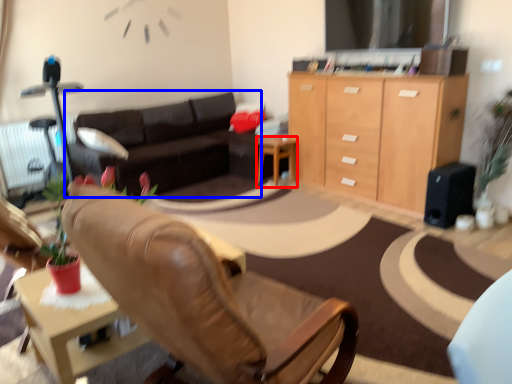
Question: Which of the following is the closest to the observer, desk (highlighted by a red box) or studio couch (highlighted by a blue box)?

Choices:
 (A) desk
 (B) studio couch

Answer: (B)